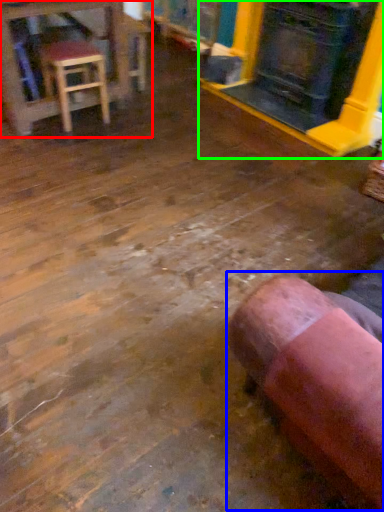
Question: Which object is positioned closest to table (highlighted by a red box)? Select from bean bag chair (highlighted by a blue box) and fireplace (highlighted by a green box).

Choices:
 (A) bean bag chair
 (B) fireplace

Answer: (B)